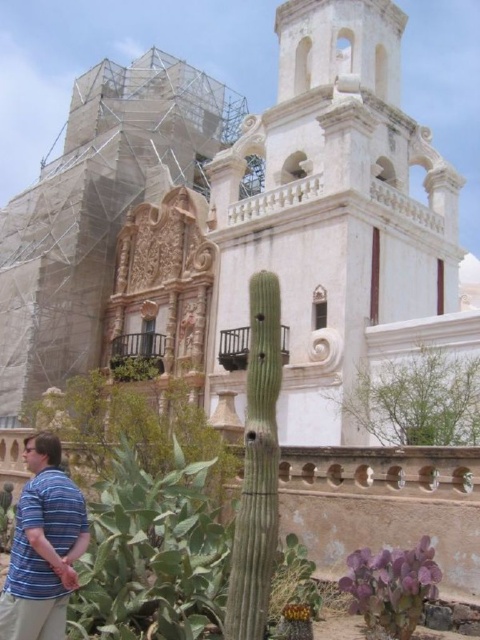
Question: Which of these objects is positioned farthest from the green leafy bush at center?

Choices:
 (A) blue striped shirt at lower left
 (B) green leafy plant at upper center

Answer: (B)

Question: Which object is the farthest from the green leafy bush at center?

Choices:
 (A) green leafy plant at upper center
 (B) blue striped shirt at lower left

Answer: (A)

Question: Which of the following is the closest to the observer?

Choices:
 (A) green leafy bush at center
 (B) purple matte plant at lower center
 (C) green leafy plant at upper center

Answer: (B)

Question: Does blue striped shirt at lower left appear over purple matte plant at lower center?

Choices:
 (A) yes
 (B) no

Answer: (A)

Question: Can you confirm if purple matte plant at lower center is positioned to the left of green leafy bush at center?

Choices:
 (A) yes
 (B) no

Answer: (B)

Question: Does blue striped shirt at lower left appear on the left side of purple matte plant at lower center?

Choices:
 (A) yes
 (B) no

Answer: (A)